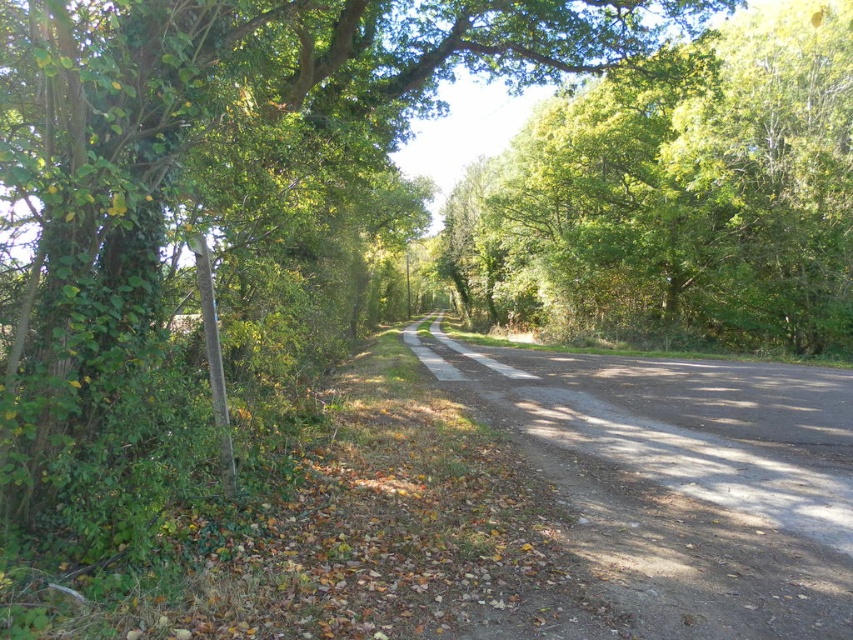
Question: Does green leafy tree at left appear on the right side of green leafy tree at upper center?

Choices:
 (A) no
 (B) yes

Answer: (A)

Question: Which point is closer to the camera taking this photo?

Choices:
 (A) (849, 204)
 (B) (392, 90)

Answer: (B)

Question: Can you confirm if green leafy tree at left is thinner than green leafy tree at upper center?

Choices:
 (A) yes
 (B) no

Answer: (A)

Question: Is green leafy tree at left thinner than green leafy tree at upper center?

Choices:
 (A) no
 (B) yes

Answer: (B)